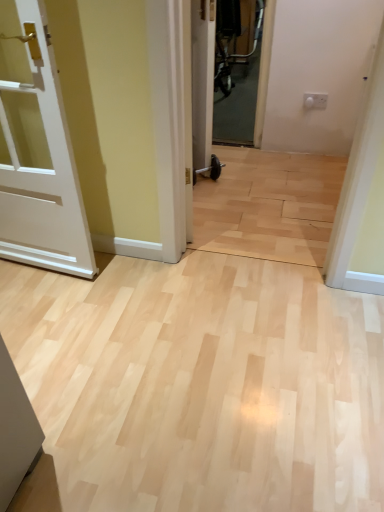
Image resolution: width=384 pixels, height=512 pixels. Describe the element at coordinates (37, 151) in the screenshot. I see `white matte door at left, which ranks as the 2th door in top-to-bottom order` at that location.

Where is `white matte door at left, arranged as the 2th door when viewed from the right`? The width and height of the screenshot is (384, 512). white matte door at left, arranged as the 2th door when viewed from the right is located at coordinates (37, 151).

Measure the distance between point (55, 106) and camera.

Point (55, 106) and camera are 4.95 feet apart.

What is the approximate height of white glossy door at center, which is the first door in back-to-front order?

97.77 centimeters.

What is the approximate width of white glossy door at center, which is the 1th door in right-to-left order?

white glossy door at center, which is the 1th door in right-to-left order, is 4.75 inches in width.

Describe the element at coordinates (202, 81) in the screenshot. I see `white glossy door at center, which is the second door in front-to-back order` at that location.

Where is `white glossy door at center, which is the first door in back-to-front order`? The image size is (384, 512). white glossy door at center, which is the first door in back-to-front order is located at coordinates (202, 81).

The width and height of the screenshot is (384, 512). I want to click on white matte door at left, arranged as the 1th door when viewed from the front, so click(x=37, y=151).

Is white matte door at left, which ranks as the 2th door in top-to-bottom order, to the right of white glossy door at center, the 2th door in the left-to-right sequence, from the viewer's perspective?

No, white matte door at left, which ranks as the 2th door in top-to-bottom order, is not to the right of white glossy door at center, the 2th door in the left-to-right sequence.

Considering the positions of objects white matte door at left, which is the 1th door from bottom to top, and white glossy door at center, the 2th door in the left-to-right sequence, in the image provided, who is in front, white matte door at left, which is the 1th door from bottom to top, or white glossy door at center, the 2th door in the left-to-right sequence,?

Positioned in front is white matte door at left, which is the 1th door from bottom to top.

Does point (7, 149) lie behind point (212, 46)?

No, it is in front of (212, 46).

From the image's perspective, is white matte door at left, the second door in the back-to-front sequence, below white glossy door at center, positioned as the first door in top-to-bottom order?

Yes.

From a real-world perspective, which is physically above, white matte door at left, which is the 1th door from bottom to top, or white glossy door at center, which is the first door in back-to-front order?

white matte door at left, which is the 1th door from bottom to top.

Which of these two, white matte door at left, which is the 1th door from bottom to top, or white glossy door at center, which ranks as the 2th door in bottom-to-top order, is thinner?

Thinner between the two is white glossy door at center, which ranks as the 2th door in bottom-to-top order.

Can you confirm if white matte door at left, arranged as the 1th door when viewed from the front, is taller than white glossy door at center, which ranks as the 2th door in bottom-to-top order?

Yes.

Is white matte door at left, which is the 1th door from bottom to top, smaller than white glossy door at center, which ranks as the 2th door in bottom-to-top order?

Incorrect, white matte door at left, which is the 1th door from bottom to top, is not smaller in size than white glossy door at center, which ranks as the 2th door in bottom-to-top order.

Is white glossy door at center, positioned as the first door in top-to-bottom order, located within white matte door at left, arranged as the 1th door when viewed from the front?

No.

Is white matte door at left, arranged as the 2th door when viewed from the right, placed right next to white glossy door at center, which is the second door in front-to-back order?

No, white matte door at left, arranged as the 2th door when viewed from the right, is not making contact with white glossy door at center, which is the second door in front-to-back order.

Is white matte door at left, the second door in the back-to-front sequence, oriented away from white glossy door at center, which is the first door in back-to-front order?

white matte door at left, the second door in the back-to-front sequence, does not have its back to white glossy door at center, which is the first door in back-to-front order.

You are a GUI agent. You are given a task and a screenshot of the screen. Output one action in this format:
    pyautogui.click(x=<x>, y=<y>)
    Task: Click on the door below the white matte door at left, which is the 1th door from bottom to top (from a real-world perspective)
    
    Given the screenshot: What is the action you would take?
    pyautogui.click(x=202, y=81)

Considering the relative positions of white glossy door at center, the 2th door in the left-to-right sequence, and white matte door at left, arranged as the 2th door when viewed from the right, in the image provided, is white glossy door at center, the 2th door in the left-to-right sequence, to the right of white matte door at left, arranged as the 2th door when viewed from the right, from the viewer's perspective?

Yes.

Who is more distant, white glossy door at center, positioned as the first door in top-to-bottom order, or white matte door at left, which is the 1th door from bottom to top?

white glossy door at center, positioned as the first door in top-to-bottom order, is behind.

Does point (204, 72) appear closer or farther from the camera than point (59, 94)?

Point (204, 72) appears to be farther away from the viewer than point (59, 94).

From the image's perspective, is white glossy door at center, which is the first door in back-to-front order, over white matte door at left, which ranks as the 2th door in top-to-bottom order?

Indeed, from the image's perspective, white glossy door at center, which is the first door in back-to-front order, is shown above white matte door at left, which ranks as the 2th door in top-to-bottom order.

From a real-world perspective, does white glossy door at center, which is the 1th door in right-to-left order, sit lower than white matte door at left, which ranks as the 2th door in top-to-bottom order?

Yes.

Can you confirm if white glossy door at center, the 2th door in the left-to-right sequence, is wider than white matte door at left, arranged as the 1th door when viewed from the front?

No, white glossy door at center, the 2th door in the left-to-right sequence, is not wider than white matte door at left, arranged as the 1th door when viewed from the front.

Is white glossy door at center, which ranks as the 2th door in bottom-to-top order, taller than white matte door at left, arranged as the 1th door when viewed from the front?

Incorrect, the height of white glossy door at center, which ranks as the 2th door in bottom-to-top order, is not larger of that of white matte door at left, arranged as the 1th door when viewed from the front.

Based on their sizes in the image, would you say white glossy door at center, which is the second door in front-to-back order, is bigger or smaller than white matte door at left, which is the 1th door from bottom to top?

In the image, white glossy door at center, which is the second door in front-to-back order, appears to be smaller than white matte door at left, which is the 1th door from bottom to top.

Is white glossy door at center, positioned as the first door in top-to-bottom order, surrounding white matte door at left, which is the 1th door from bottom to top?

No.

Is white glossy door at center, which is the first door in back-to-front order, placed right next to white matte door at left, which ranks as the 2th door in top-to-bottom order?

white glossy door at center, which is the first door in back-to-front order, is not next to white matte door at left, which ranks as the 2th door in top-to-bottom order, and they're not touching.

Is white glossy door at center, which is the 1th door in right-to-left order, facing towards white matte door at left, arranged as the 1th door when viewed from the front?

No, white glossy door at center, which is the 1th door in right-to-left order, does not turn towards white matte door at left, arranged as the 1th door when viewed from the front.

How different are the orientations of white glossy door at center, which is the second door in front-to-back order, and white matte door at left, arranged as the 1th door when viewed from the front, in degrees?

The facing directions of white glossy door at center, which is the second door in front-to-back order, and white matte door at left, arranged as the 1th door when viewed from the front, are 22.3 degrees apart.

In the scene shown: How far apart are white glossy door at center, the 2th door in the left-to-right sequence, and white matte door at left, arranged as the 1th door when viewed from the front?

white glossy door at center, the 2th door in the left-to-right sequence, and white matte door at left, arranged as the 1th door when viewed from the front, are 1.05 meters apart from each other.

The height and width of the screenshot is (512, 384). Identify the location of door that appears in front of the white glossy door at center, which is the 1th door in right-to-left order. (37, 151).

Find the location of a particular element. This screenshot has width=384, height=512. door in front of the white glossy door at center, which is the second door in front-to-back order is located at coordinates (37, 151).

Where is `door on the right side of white matte door at left, which is the 1th door from bottom to top`? This screenshot has height=512, width=384. door on the right side of white matte door at left, which is the 1th door from bottom to top is located at coordinates (202, 81).